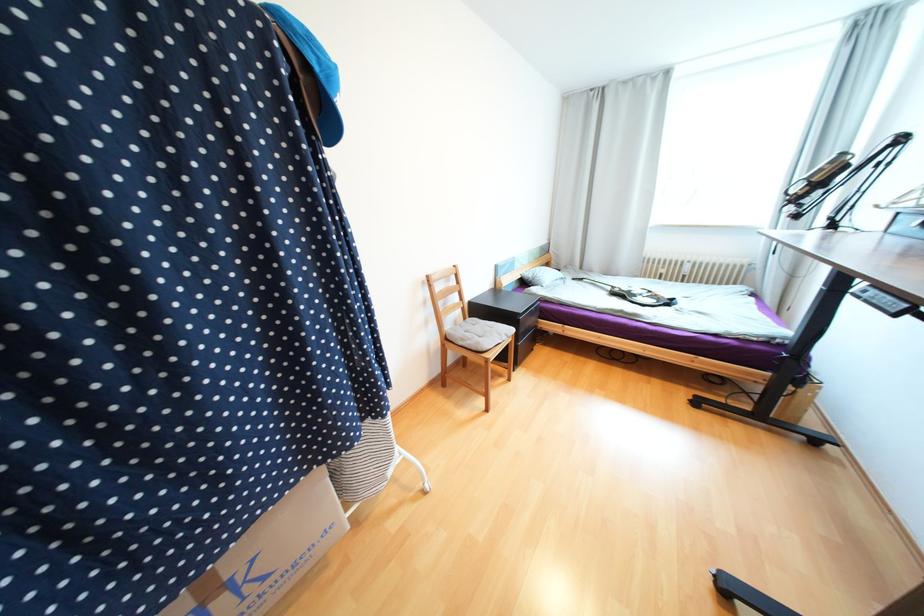
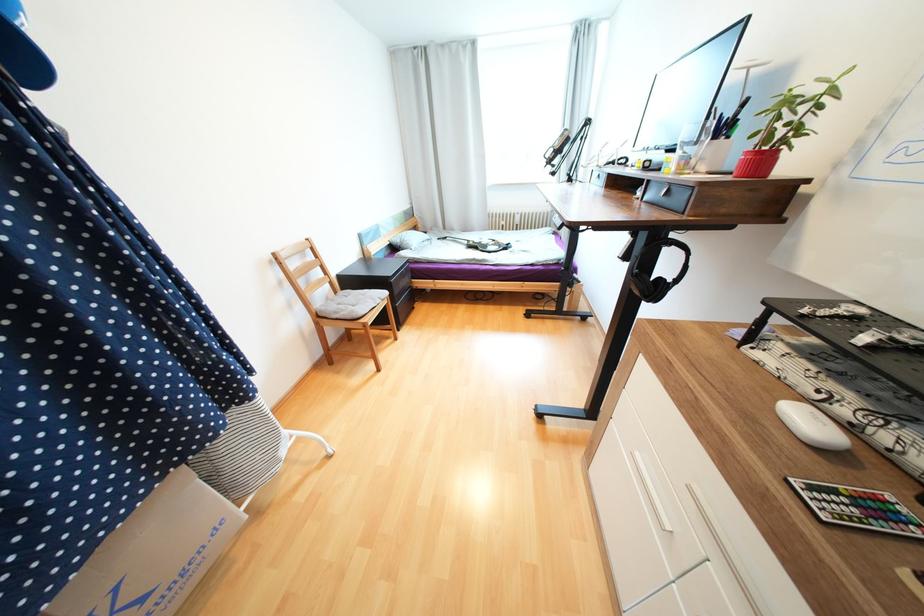
In the second image, find the point that corresponds to [614,288] in the first image.

(471, 243)